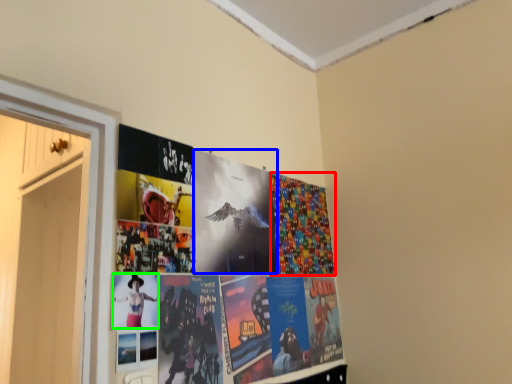
Question: Which object is the farthest from flyer (highlighted by a red box)? Choose among these: flyer (highlighted by a blue box) or person (highlighted by a green box).

Choices:
 (A) flyer
 (B) person

Answer: (B)